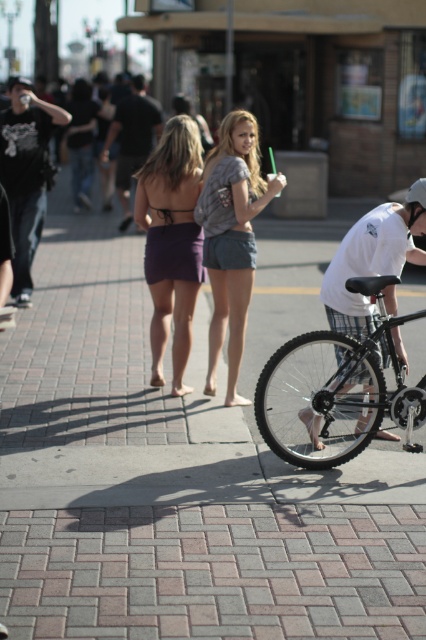
Question: Which is nearer to the white cotton shirt at center?

Choices:
 (A) brick pavement at center
 (B) shiny black bike at lower right
 (C) denim shorts at center
 (D) matte black t-shirt at left

Answer: (B)

Question: Can you confirm if purple matte skirt at center is positioned to the right of matte black t-shirt at left?

Choices:
 (A) no
 (B) yes

Answer: (B)

Question: Does denim shorts at center appear over matte black t-shirt at left?

Choices:
 (A) no
 (B) yes

Answer: (A)

Question: Is shiny black bike at lower right to the right of matte black t-shirt at left from the viewer's perspective?

Choices:
 (A) no
 (B) yes

Answer: (B)

Question: Which point appears farthest from the camera in this image?

Choices:
 (A) (386, 348)
 (B) (176, 253)

Answer: (B)

Question: Which object is the farthest from the white cotton shirt at center?

Choices:
 (A) brick pavement at center
 (B) shiny black bike at lower right
 (C) matte black t-shirt at left

Answer: (C)